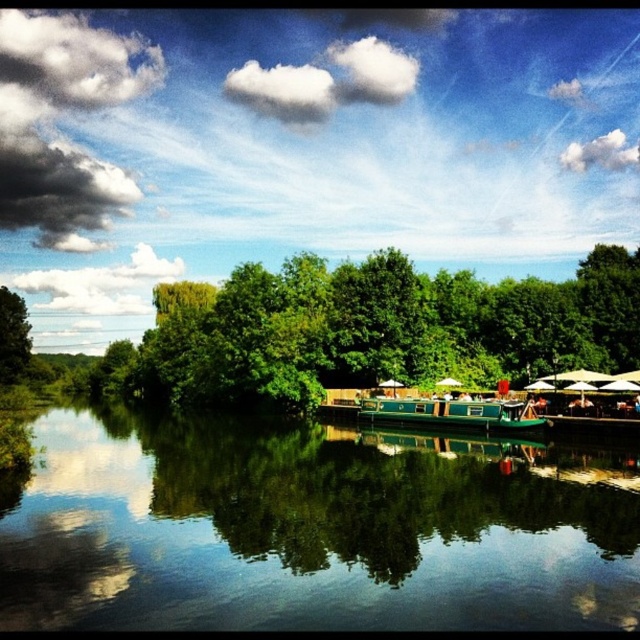
You are planning to set up a picnic blanket between the green leafy tree at center and the green leafy tree at left. Which tree has a wider canopy to provide more shade?

The green leafy tree at center has a wider canopy than the green leafy tree at left, so it provides more shade.

You are a landscape architect planning to install a new pathway between the green leafy tree at center and the green leafy tree at left. The pathway must be 40 meters long to accommodate visitors. Based on the scene, will the pathway fit between these two trees?

The distance between the green leafy tree at center and the green leafy tree at left is 41.39 meters, which is longer than the 40 meters required for the pathway. Therefore, the pathway will fit between them with some extra space remaining.

You are standing at the riverside and want to determine which of the two points, point (589, 269) or point (392, 401), is closer to you. Based on the scene, which point is nearer?

Point (589, 269) is further to the viewer than point (392, 401), so the closer point to you is point (392, 401).